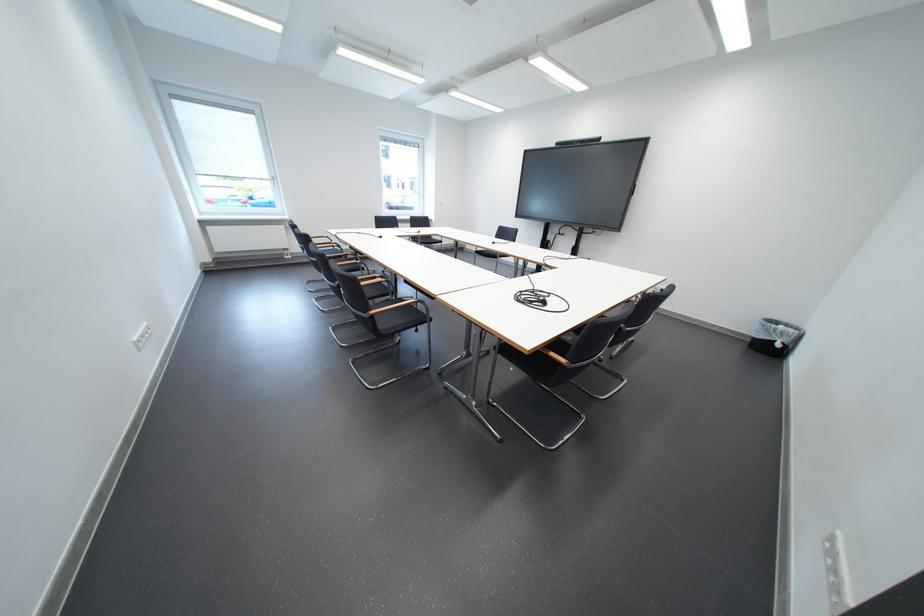
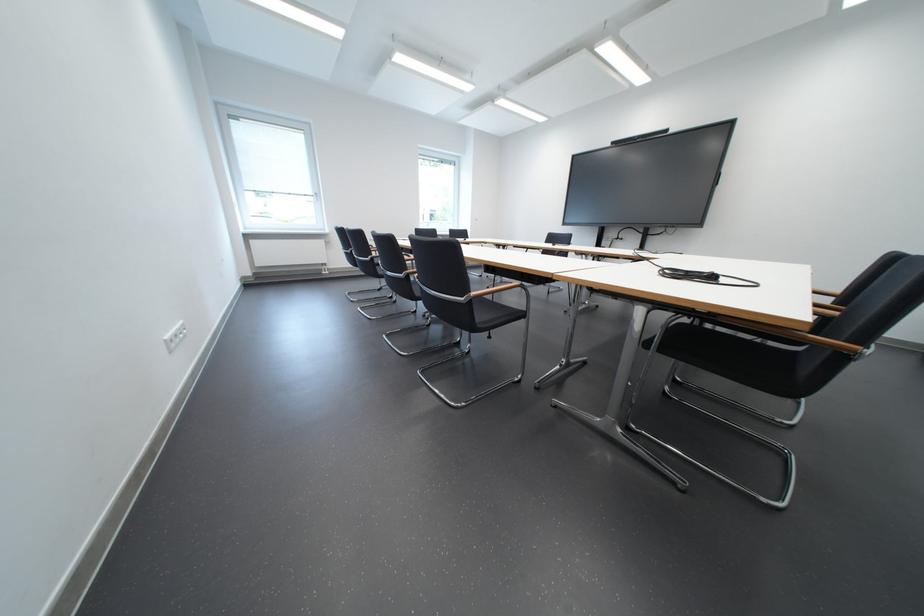
Question: Based on the continuous images, in which direction is the camera rotating? Reply with the corresponding letter.

Choices:
 (A) Left
 (B) Right
 (C) Up
 (D) Down

Answer: (C)